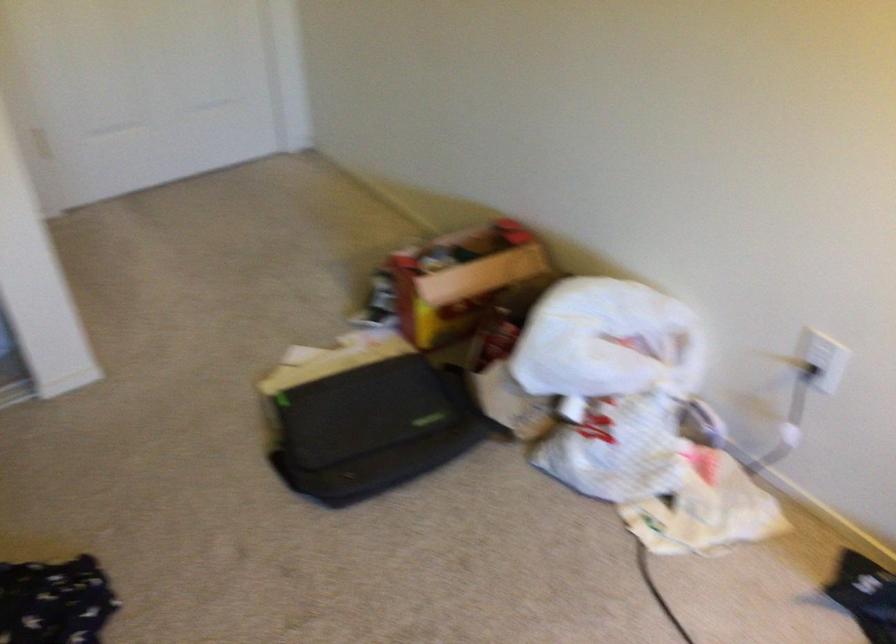
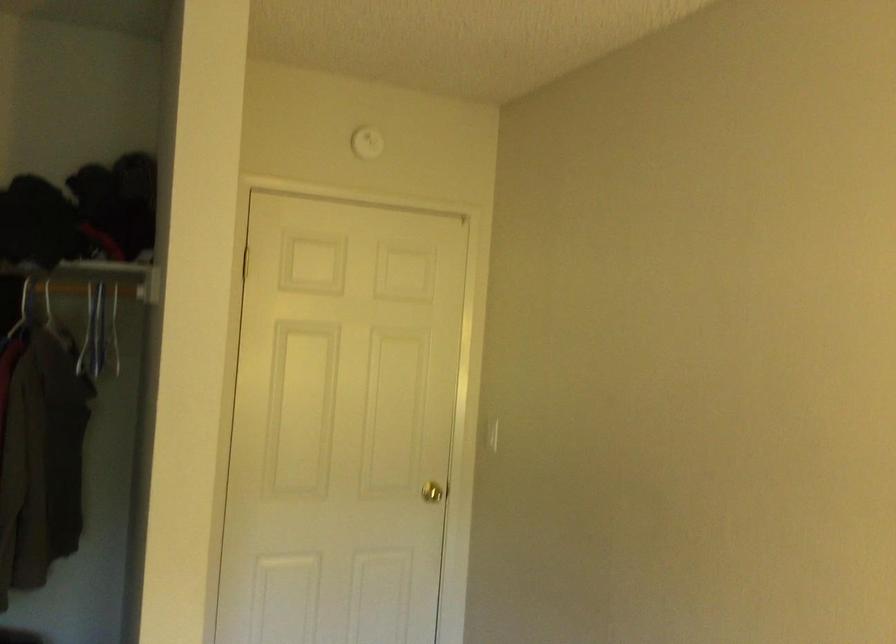
The images are taken continuously from a first-person perspective. In which direction is your viewpoint rotating?

The rotation direction of the camera is left-up.